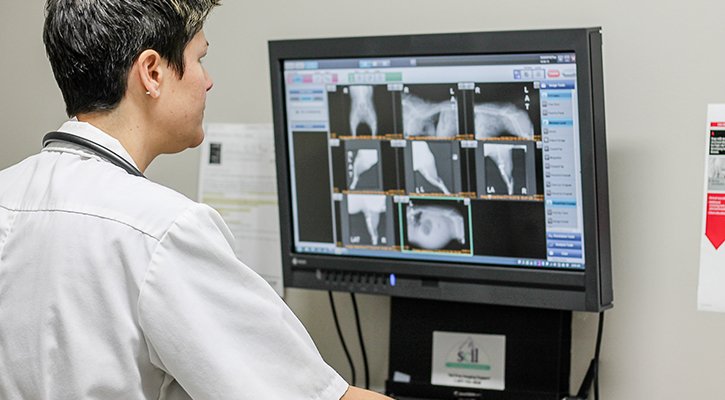
Locate an element on the screen. The height and width of the screenshot is (400, 725). computer cable is located at coordinates (600, 333), (356, 312), (335, 317).